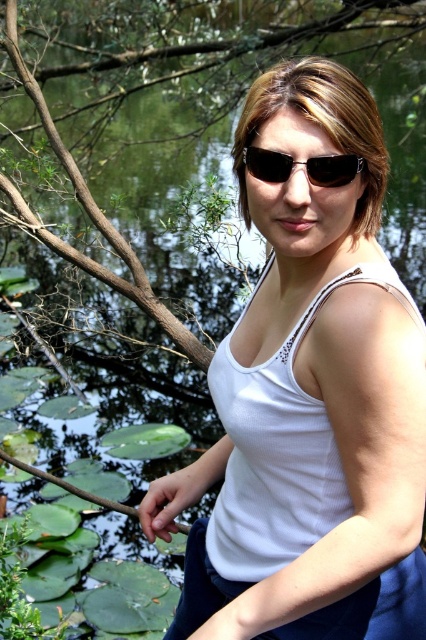
Question: Which point appears farthest from the camera in this image?

Choices:
 (A) (399, 442)
 (B) (322, 184)

Answer: (B)

Question: Which of the following is the farthest from the observer?

Choices:
 (A) (319, 168)
 (B) (368, 184)

Answer: (B)

Question: Is the position of white matte tank top at center more distant than that of black plastic sunglasses at center?

Choices:
 (A) no
 (B) yes

Answer: (A)

Question: From the image, what is the correct spatial relationship of white matte tank top at center in relation to black plastic sunglasses at center?

Choices:
 (A) right
 (B) left

Answer: (B)

Question: Which of the following is the closest to the observer?

Choices:
 (A) white matte tank top at center
 (B) black plastic sunglasses at center

Answer: (A)

Question: Is white matte tank top at center above black plastic sunglasses at center?

Choices:
 (A) no
 (B) yes

Answer: (A)